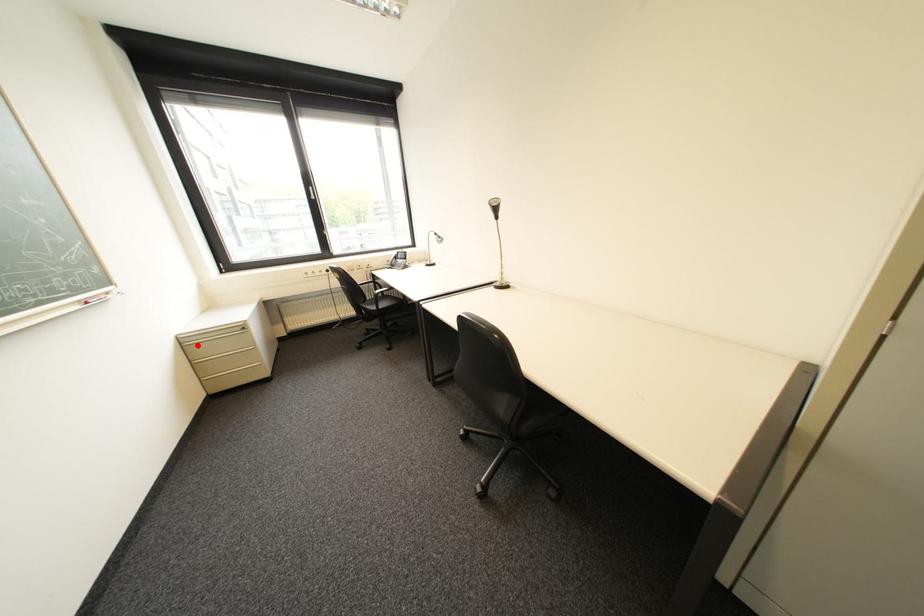
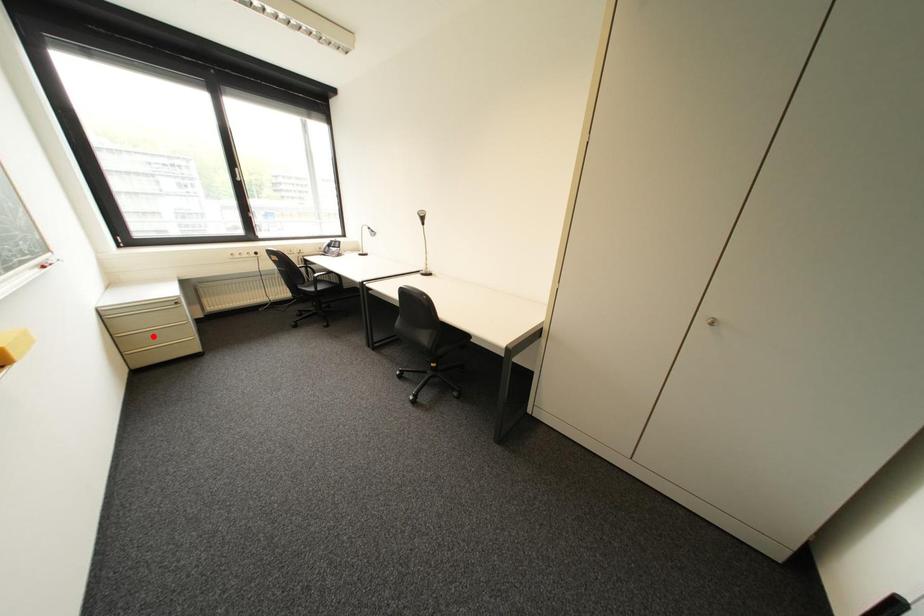
I am providing you with two images of the same scene from different viewpoints. A red point is marked on the first image and another point is marked on the second image. Is the marked point in image1 the same physical position as the marked point in image2?

No